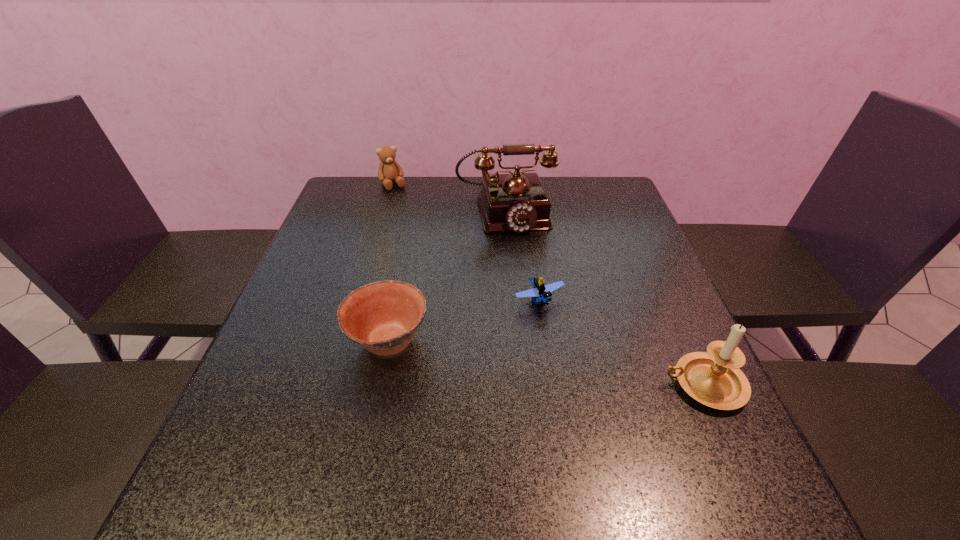
Where is `free location located 0.270m on the dial of the tallest object`? free location located 0.270m on the dial of the tallest object is located at coordinates (533, 306).

Find the location of a particular element. The width and height of the screenshot is (960, 540). vacant space located on the dial of the tallest object is located at coordinates (538, 325).

You are a GUI agent. You are given a task and a screenshot of the screen. Output one action in this format:
    pyautogui.click(x=<x>, y=<y>)
    Task: Click on the vacant space located 0.180m on the dial of the tallest object
    
    Given the screenshot: What is the action you would take?
    pyautogui.click(x=525, y=280)

At what (x,y) coordinates should I click in order to perform the action: click on vacant area located 0.060m on the face of the third tallest object. Please return your answer as a coordinate pair (x, y). The width and height of the screenshot is (960, 540). Looking at the image, I should click on (403, 200).

This screenshot has width=960, height=540. Identify the location of vacant space located 0.210m on the face of the third tallest object. (420, 226).

You are a GUI agent. You are given a task and a screenshot of the screen. Output one action in this format:
    pyautogui.click(x=<x>, y=<y>)
    Task: Click on the vacant space located on the face of the third tallest object
    This screenshot has height=540, width=960.
    Given the screenshot: What is the action you would take?
    pyautogui.click(x=402, y=199)

This screenshot has width=960, height=540. I want to click on vacant space located on the front-facing side of the shortest object, so click(594, 377).

Locate an element on the screen. The image size is (960, 540). free space located on the front-facing side of the shortest object is located at coordinates (588, 369).

The height and width of the screenshot is (540, 960). In order to click on vacant space located 0.140m on the front-facing side of the shortest object in this screenshot , I will do `click(584, 362)`.

Where is `telephone that is positioned at the far edge`? telephone that is positioned at the far edge is located at coordinates (517, 202).